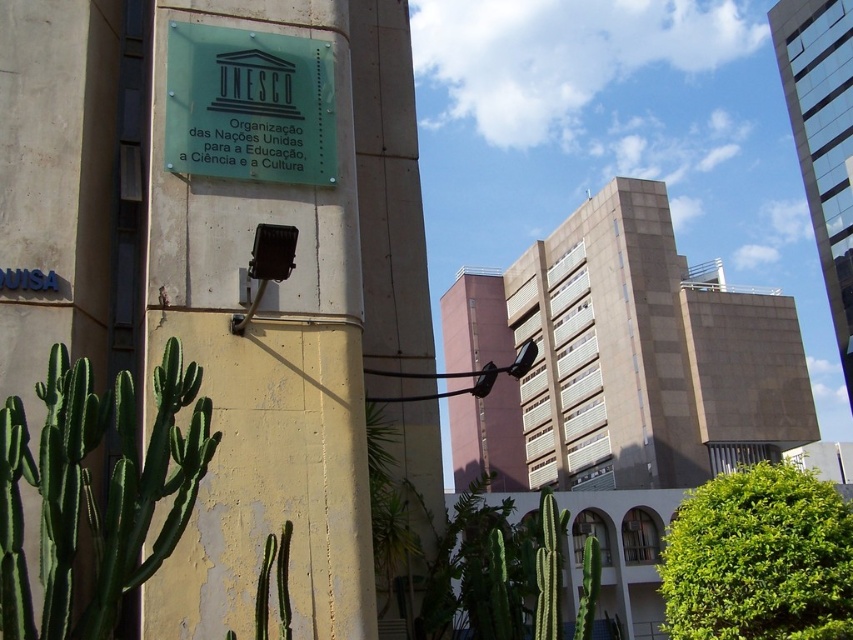
Does green spiky cactus at lower left have a lesser height compared to transparent glass sign at upper center?

No, green spiky cactus at lower left is not shorter than transparent glass sign at upper center.

Image resolution: width=853 pixels, height=640 pixels. What do you see at coordinates (91, 490) in the screenshot?
I see `green spiky cactus at lower left` at bounding box center [91, 490].

What are the coordinates of `green spiky cactus at lower left` in the screenshot? It's located at (91, 490).